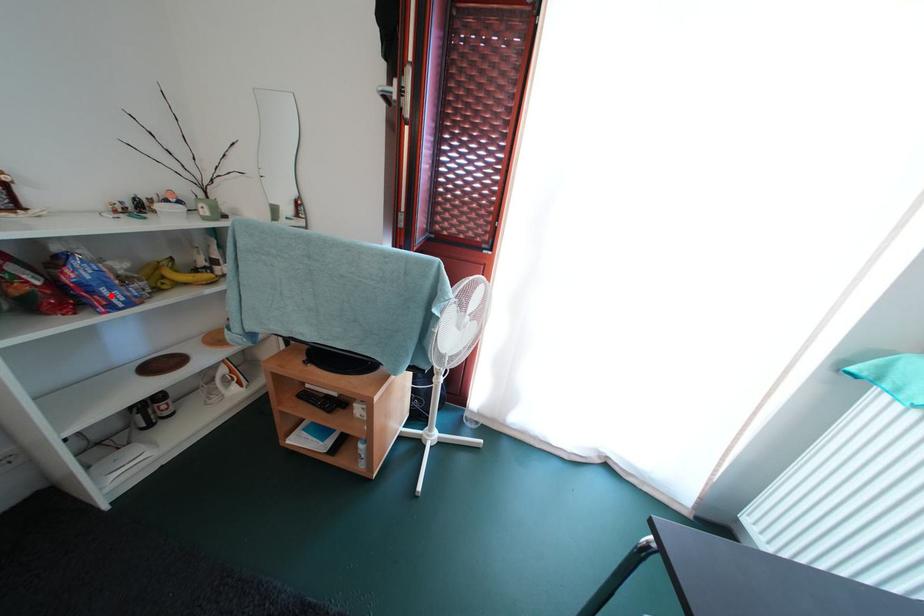
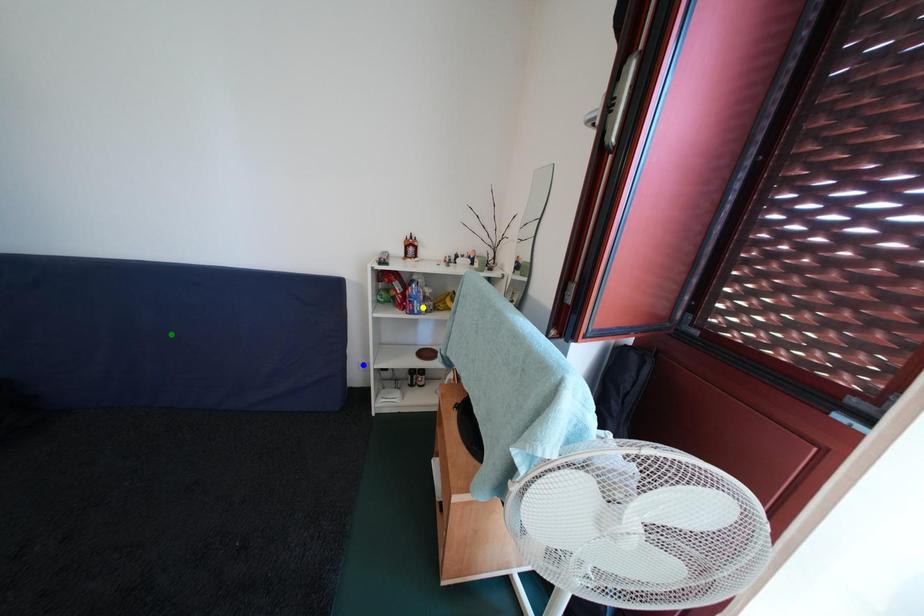
Question: I am providing you with two images of the same scene from different viewpoints. A red point is marked on the first image. You are given multiple points on the second image. Which point in image 2 is actually the same real-world point as the red point in image 1?

Choices:
 (A) blue point
 (B) green point
 (C) yellow point

Answer: (C)